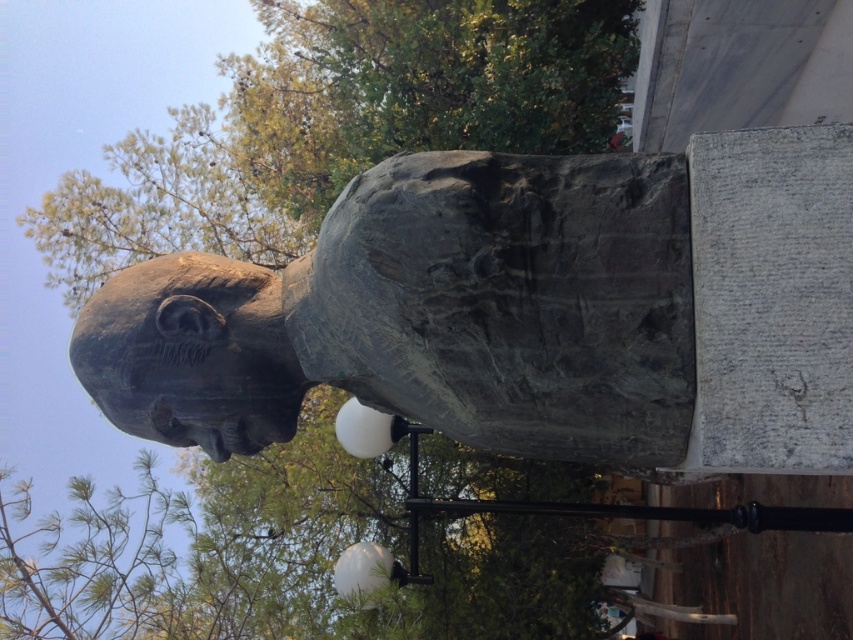
You are an art student visiting a park and see the bronze statue at center and the bronze sculpture at center. Which one is bigger?

The bronze statue at center is larger in size than the bronze sculpture at center.

You are an art student observing the bronze statue at center and the bronze sculpture at center in the park. Which of the two has a greater width?

The bronze statue at center has a greater width than the bronze sculpture at center.

You are standing in a park and see both the bronze statue at center and the bronze sculpture at center. According to their positions, which one is located to the right?

The bronze statue at center is located to the right of the bronze sculpture at center.